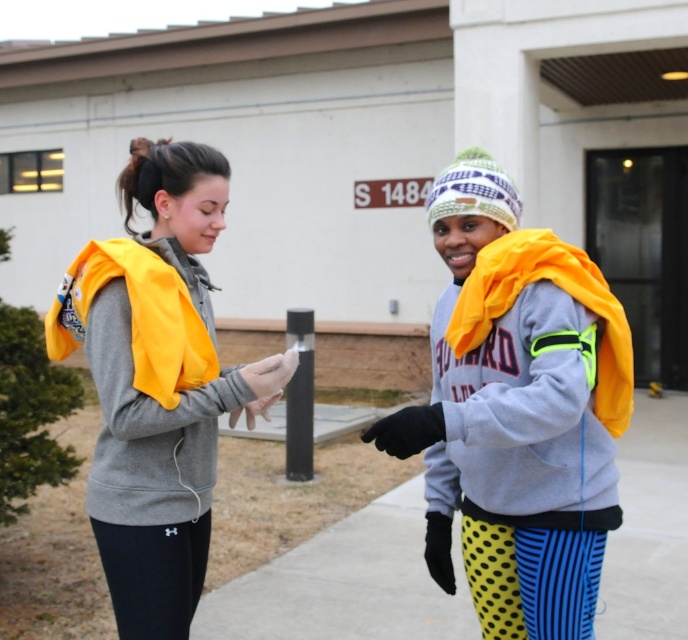
Who is more distant from viewer, (147,250) or (89,486)?

The point (89,486) is more distant.

Can you confirm if matte gray hoodie at center is wider than gray fleece sweatshirt at left?

Correct, the width of matte gray hoodie at center exceeds that of gray fleece sweatshirt at left.

Between point (65, 340) and point (92, 339), which one is positioned in front?

Point (92, 339)

At what (x,y) coordinates should I click in order to perform the action: click on matte gray hoodie at center. Please return your answer as a coordinate pair (x, y). Looking at the image, I should click on (158, 384).

Does smooth concrete pavement at center appear under gray fleece sweatshirt at left?

Yes.

Is smooth concrete pavement at center taller than gray fleece sweatshirt at left?

In fact, smooth concrete pavement at center may be shorter than gray fleece sweatshirt at left.

This screenshot has height=640, width=688. Identify the location of smooth concrete pavement at center. (347, 582).

Where is `smooth concrete pavement at center`? The height and width of the screenshot is (640, 688). smooth concrete pavement at center is located at coordinates (347, 582).

Does matte gray hoodie at center have a greater width compared to smooth concrete pavement at center?

No.

Which is behind, point (283, 371) or point (389, 604)?

The point (389, 604) is more distant.

In order to click on matte gray hoodie at center in this screenshot , I will do click(x=158, y=384).

Where is `matte gray hoodie at center`? This screenshot has height=640, width=688. matte gray hoodie at center is located at coordinates point(158,384).